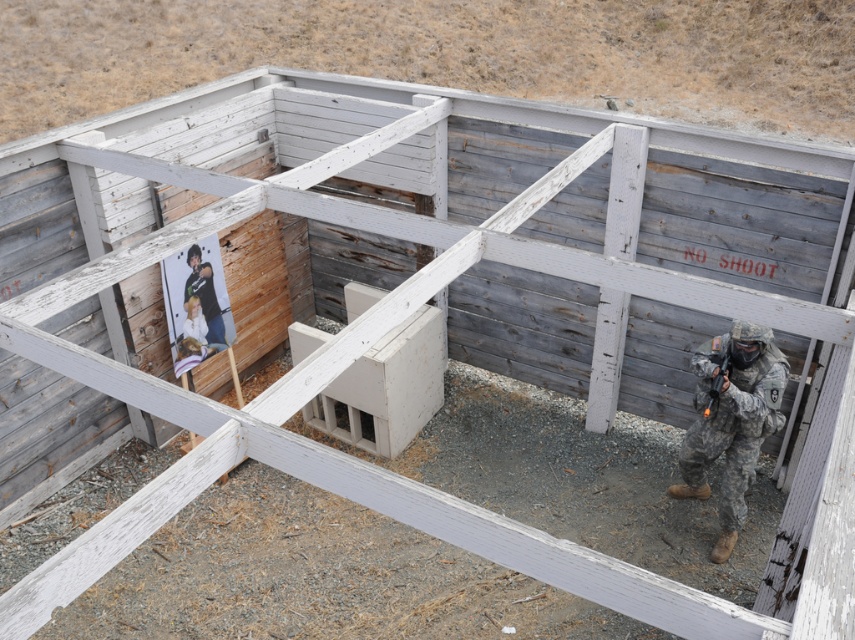
You are a trainee in the military exercise area. You see a camouflage fabric soldier at right and a camouflage uniform at center. Which object is closer to you?

The camouflage fabric soldier at right is closer to you because it is in front of the camouflage uniform at center.

You are a military trainee who needs to carry both the camouflage fabric soldier at right and the matte black rifle at right during a mission. If you have a backpack with a width capacity of 1 meter, can you carry both items together without exceeding the backpack width limit?

The camouflage fabric soldier at right might be wider than matte black rifle at right. Since the exact width of the soldier is not provided, it is uncertain whether both items combined would exceed the 1 meter backpack width limit. You should measure both items to confirm.